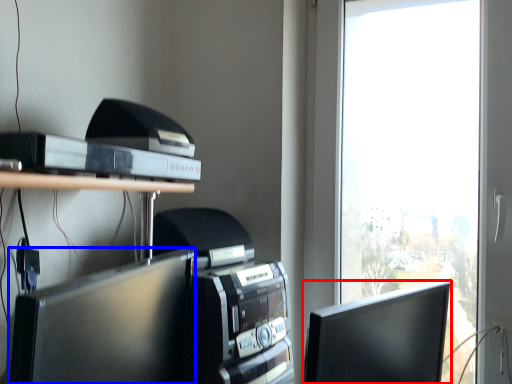
Question: Which of the following is the farthest to the observer, computer monitor (highlighted by a red box) or computer monitor (highlighted by a blue box)?

Choices:
 (A) computer monitor
 (B) computer monitor

Answer: (A)